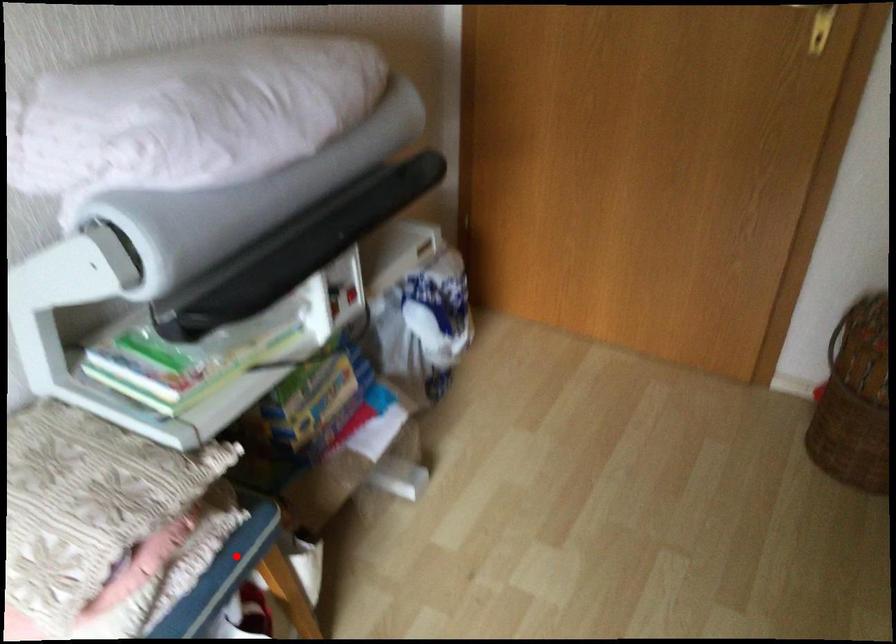
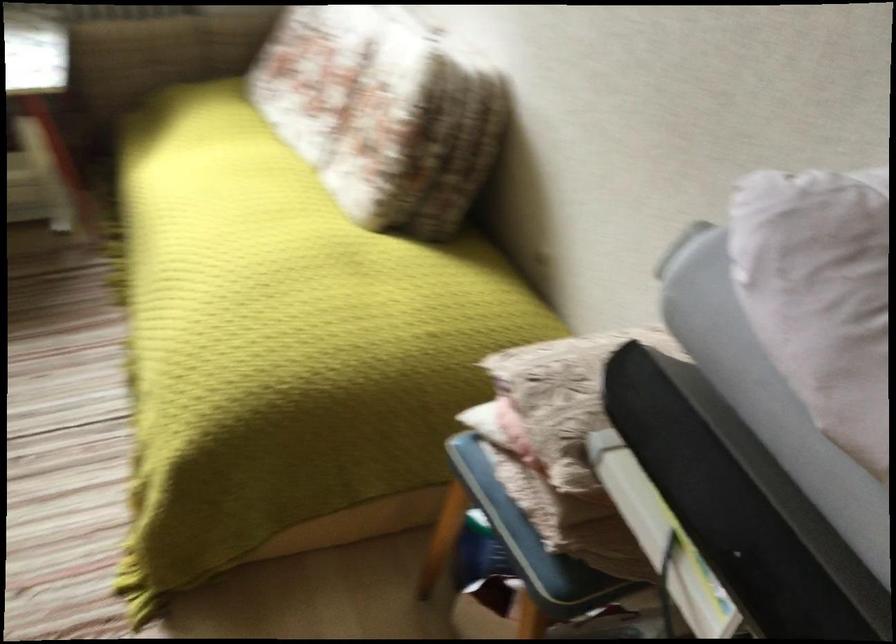
Where in the second image is the point corresponding to the highlighted location from the first image?

(528, 534)